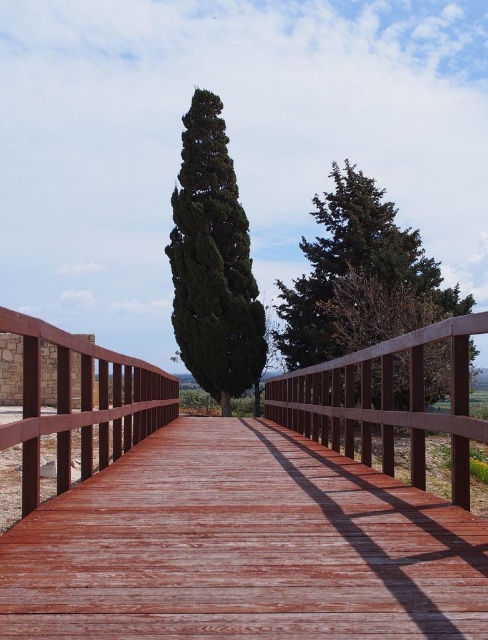
Question: Considering the real-world distances, which object is farthest from the green matte tree at center?

Choices:
 (A) wooden bridge at center
 (B) green textured tree at upper center
 (C) wooden fence at center
 (D) wooden rail at left

Answer: (A)

Question: Can you confirm if wooden bridge at center is bigger than wooden fence at center?

Choices:
 (A) yes
 (B) no

Answer: (A)

Question: From the image, what is the correct spatial relationship of wooden fence at center in relation to wooden rail at left?

Choices:
 (A) below
 (B) above

Answer: (A)

Question: Which point is farther to the camera?

Choices:
 (A) wooden rail at left
 (B) wooden fence at center
 (C) green matte tree at center
 (D) wooden bridge at center

Answer: (C)

Question: Which point is closer to the camera taking this photo?

Choices:
 (A) (199, 189)
 (B) (63, 445)
 (C) (361, 273)
 (D) (448, 332)

Answer: (D)

Question: Can you confirm if wooden fence at center is positioned to the left of wooden rail at left?

Choices:
 (A) yes
 (B) no

Answer: (B)